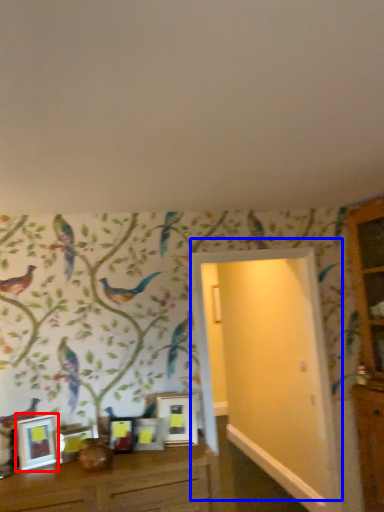
Question: Which object appears closest to the camera in this image, picture frame (highlighted by a red box) or door (highlighted by a blue box)?

Choices:
 (A) picture frame
 (B) door

Answer: (A)